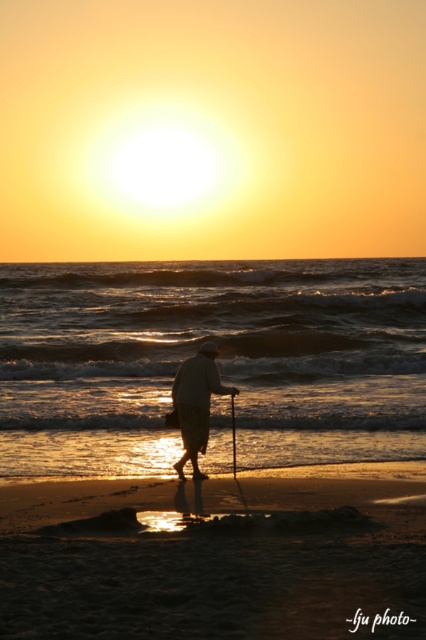
Question: Which point is closer to the camera?

Choices:
 (A) sandy beach at lower center
 (B) white cloth at center

Answer: (A)

Question: Can you confirm if sandy beach at lower center is wider than white cloth at center?

Choices:
 (A) yes
 (B) no

Answer: (A)

Question: From the image, what is the correct spatial relationship of sandy beach at lower center in relation to white cloth at center?

Choices:
 (A) above
 (B) below

Answer: (B)

Question: Which object is farther from the camera taking this photo?

Choices:
 (A) sandy beach at lower center
 (B) white cloth at center

Answer: (B)

Question: Can you confirm if sandy beach at lower center is positioned below white cloth at center?

Choices:
 (A) yes
 (B) no

Answer: (A)